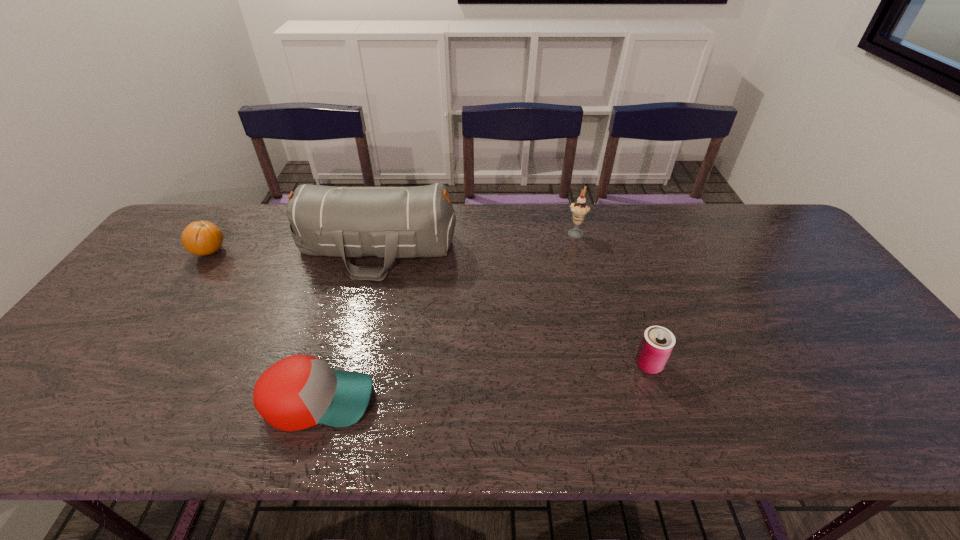
I want to click on vacant area at the right edge of the desktop, so click(x=845, y=340).

At what (x,y) coordinates should I click in order to perform the action: click on vacant space at the far left corner. Please return your answer as a coordinate pair (x, y). Looking at the image, I should click on (227, 221).

Identify the location of free space at the far right corner of the desktop. Image resolution: width=960 pixels, height=540 pixels. (770, 233).

At what (x,y) coordinates should I click in order to perform the action: click on free space between the can and the icecream. Please return your answer as a coordinate pair (x, y). This screenshot has width=960, height=540. Looking at the image, I should click on (612, 298).

The height and width of the screenshot is (540, 960). In order to click on free space between the rightmost object and the leftmost object in this screenshot , I will do `click(429, 308)`.

At what (x,y) coordinates should I click in order to perform the action: click on vacant area that lies between the rightmost object and the baseball cap. Please return your answer as a coordinate pair (x, y). Image resolution: width=960 pixels, height=540 pixels. Looking at the image, I should click on (484, 382).

The width and height of the screenshot is (960, 540). I want to click on free spot between the tallest object and the orange, so click(x=293, y=250).

The height and width of the screenshot is (540, 960). Identify the location of vacant space that's between the rightmost object and the baseball cap. (484, 382).

The image size is (960, 540). What are the coordinates of `free space that is in between the baseball cap and the icecream` in the screenshot? It's located at (446, 316).

Where is `vacant space that's between the can and the fourth shortest object`? This screenshot has width=960, height=540. vacant space that's between the can and the fourth shortest object is located at coordinates (612, 298).